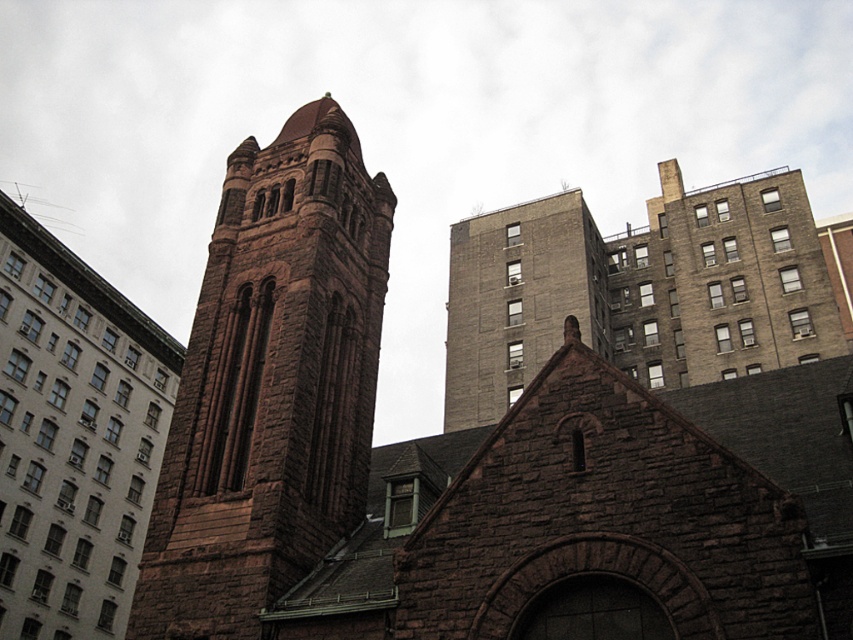
You are standing in an urban area and see the brown stone church at left. If you want to take a photo of it without any modern buildings in the foreground, which direction should you move? Please explain your reasoning based on the church and surrounding structures.

Move to the left of the brown stone church at left. Since the modern buildings are to the right of the church, moving left would place them behind you, keeping the church centered and unobstructed.

You are an urban planner analyzing the layout of this city block. You need to determine the spatial relationship between the brown stone tower at center and the brown stone church at left. Based on the image, which structure is located to the east of the other?

The brown stone tower at center is positioned on the right side of brown stone church at left, so if the church is on the left, the tower would be to its east.